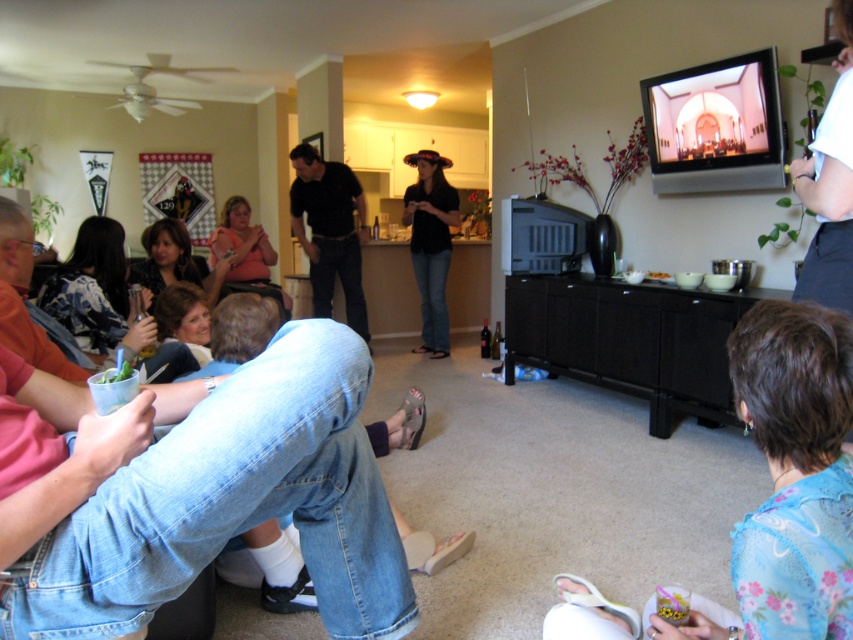
Is floral blouse at lower left to the left of black matte hat at center from the viewer's perspective?

Indeed, floral blouse at lower left is positioned on the left side of black matte hat at center.

Between point (119, 275) and point (422, 292), which one is positioned in front?

Positioned in front is point (119, 275).

I want to click on floral blouse at lower left, so click(108, 301).

Is point (97, 289) closer to viewer compared to point (341, 252)?

Yes.

From the picture: Does floral blouse at lower left appear on the left side of black matte shirt at center?

Correct, you'll find floral blouse at lower left to the left of black matte shirt at center.

Measure the distance between point (67,307) and camera.

Point (67,307) is 9.58 feet away from camera.

At what (x,y) coordinates should I click in order to perform the action: click on floral blouse at lower left. Please return your answer as a coordinate pair (x, y). The image size is (853, 640). Looking at the image, I should click on (108, 301).

Is blue floral shirt at lower right closer to camera compared to black matte shirt at center?

Yes, blue floral shirt at lower right is closer to the viewer.

Can you confirm if blue floral shirt at lower right is thinner than black matte shirt at center?

Yes, blue floral shirt at lower right is thinner than black matte shirt at center.

Is point (851, 400) in front of point (344, 305)?

Yes.

You are a GUI agent. You are given a task and a screenshot of the screen. Output one action in this format:
    pyautogui.click(x=<x>, y=<y>)
    Task: Click on the blue floral shirt at lower right
    Image resolution: width=853 pixels, height=640 pixels.
    Given the screenshot: What is the action you would take?
    pyautogui.click(x=788, y=481)